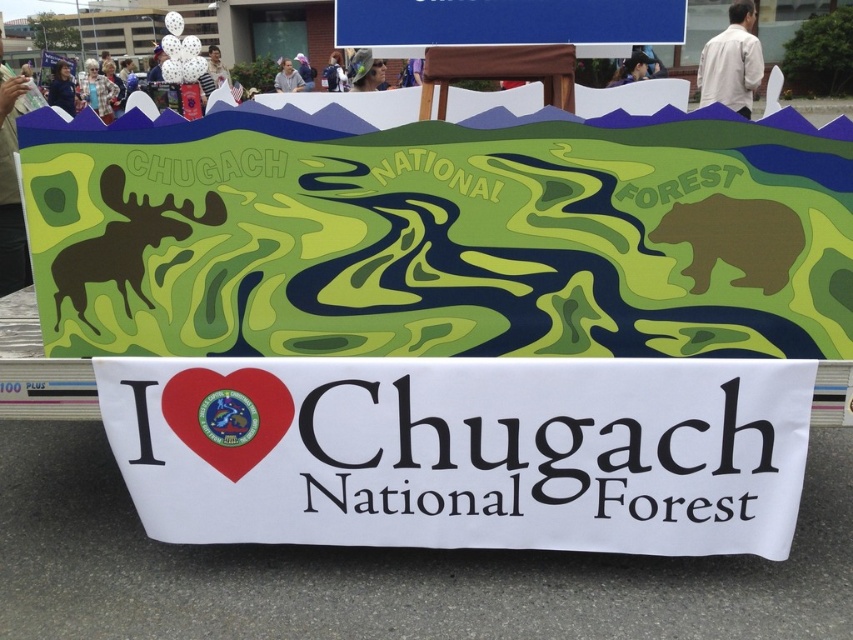
Which of these two, white cotton shirt at upper right or matte black shirt at upper left, stands taller?

Standing taller between the two is matte black shirt at upper left.

Which is more to the right, white cotton shirt at upper right or matte black shirt at upper left?

white cotton shirt at upper right is more to the right.

Between point (741, 26) and point (65, 64), which one is positioned in front?

Point (741, 26) is in front.

At what (x,y) coordinates should I click in order to perform the action: click on white cotton shirt at upper right. Please return your answer as a coordinate pair (x, y). Looking at the image, I should click on (730, 61).

How much distance is there between matte black bear at upper center and matte black backpack at upper center?

5.71 meters

Where is `matte black bear at upper center`? matte black bear at upper center is located at coordinates (631, 68).

Locate an element on the screen. matte black bear at upper center is located at coordinates (631, 68).

Which is more to the right, matte white shirt at upper center or matte black backpack at center?

From the viewer's perspective, matte black backpack at center appears more on the right side.

Which is behind, point (283, 76) or point (305, 67)?

Point (305, 67)

Is point (289, 81) behind point (300, 76)?

No, (289, 81) is closer to viewer.

What are the coordinates of `matte white shirt at upper center` in the screenshot? It's located at (287, 77).